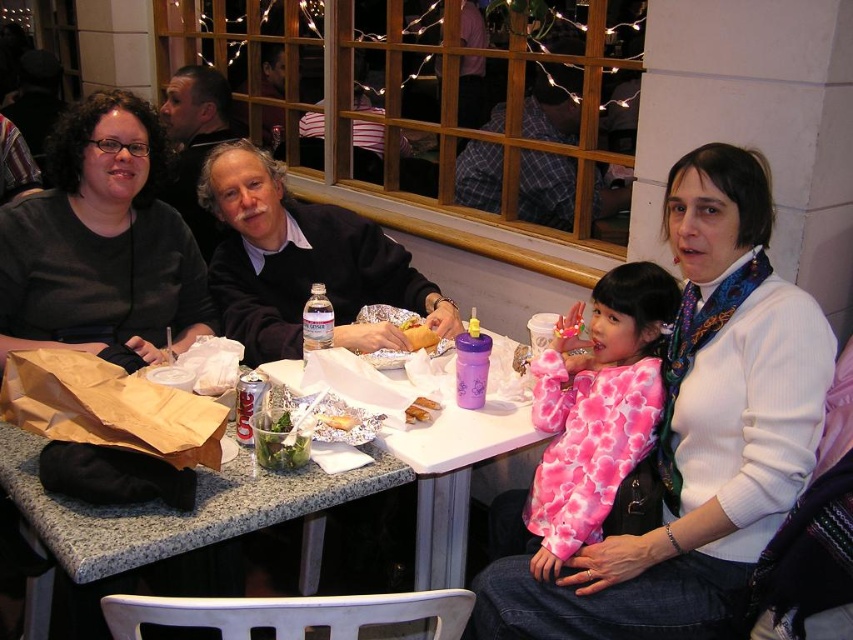
You are sitting at the table in the dining scene. You notice two points marked in the image. Which of the two points, point (416,326) or point (422,404), is closer to you?

Point (416,326) is closer to you because it is further to the viewer than point (422,404).

Based on the scene description, where is the white sweater at center located in terms of coordinates?

The white sweater at center is located at point coordinates (698,433).